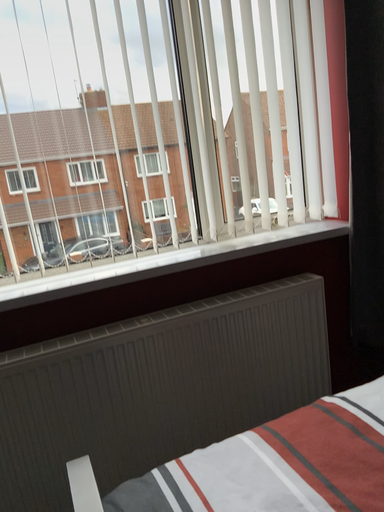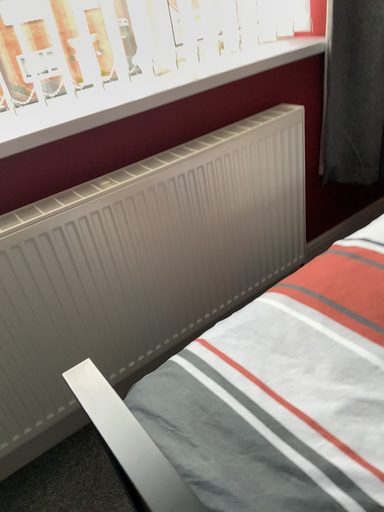
Question: How did the camera likely rotate when shooting the video?

Choices:
 (A) rotated downward
 (B) rotated upward

Answer: (A)